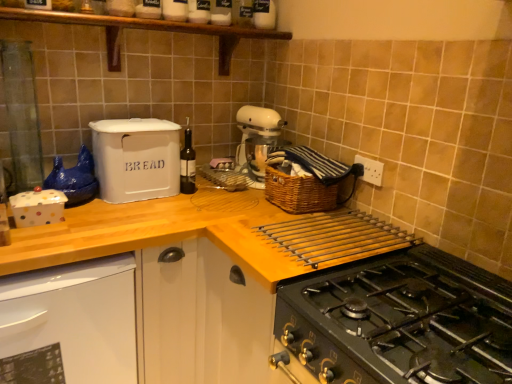
At what (x,y) coordinates should I click in order to perform the action: click on free location to the right of dark glass bottle at center. Please return your answer as a coordinate pair (x, y). Looking at the image, I should click on (219, 199).